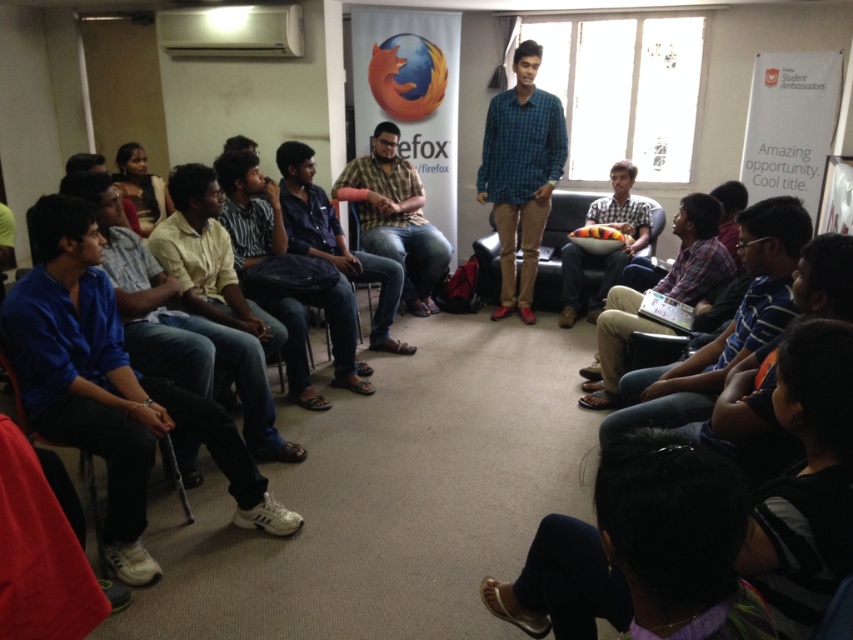
You are attending a presentation and want to greet the person in the striped shirt at lower right. To reach them, you need to walk from the yellow shirt at center. In which direction should you move?

The striped shirt at lower right is to the right of the yellow shirt at center, so you should move to the right to reach them.

You are attending a presentation and notice two shirts at the center of the room. The green checkered shirt at center and the striped shirt at center. Which shirt is covering part of the other?

The green checkered shirt at center is positioned over striped shirt at center, so it is covering part of the striped shirt at center.

You are standing in the room and want to place a small table between the two points labeled point (109, 428) and point (241, 312). Which point should the table be closer to in order to be nearer to the speaker?

The table should be closer to point (109, 428) because it is nearer to the viewer than point (241, 312), meaning it is physically closer to the speaker who is at the center of the room.